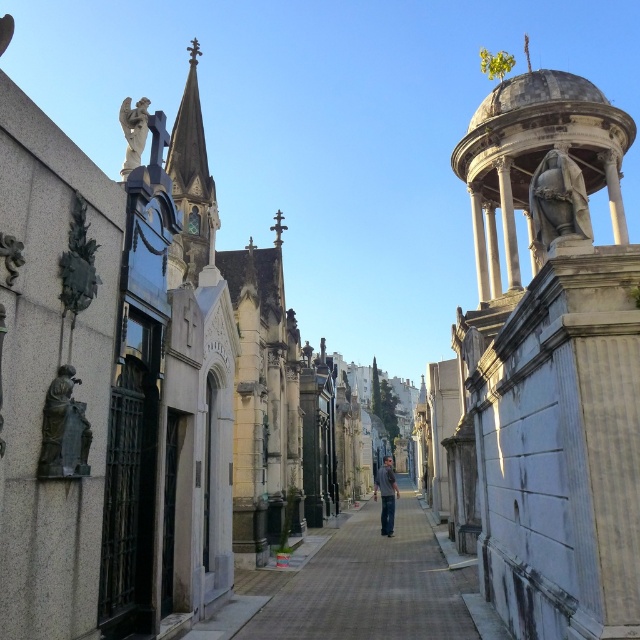
Question: Among these objects, which one is nearest to the camera?

Choices:
 (A) white marble statue at upper center
 (B) gray fabric jacket at center
 (C) brick paved walkway at center

Answer: (A)

Question: Can you confirm if white marble statue at upper center is positioned to the left of gray fabric jacket at center?

Choices:
 (A) yes
 (B) no

Answer: (A)

Question: Which point is closer to the camera?

Choices:
 (A) bronze statue at left
 (B) white marble statue at upper center
 (C) polished stone statue at right

Answer: (B)

Question: Is brick paved walkway at center to the left of polished stone statue at right from the viewer's perspective?

Choices:
 (A) yes
 (B) no

Answer: (A)

Question: Which point is closer to the camera?

Choices:
 (A) (371, 588)
 (B) (120, 120)
 (C) (385, 525)
 (D) (600, 614)

Answer: (D)

Question: Does white marble statue at upper center appear over white marble angel at upper left?

Choices:
 (A) yes
 (B) no

Answer: (B)